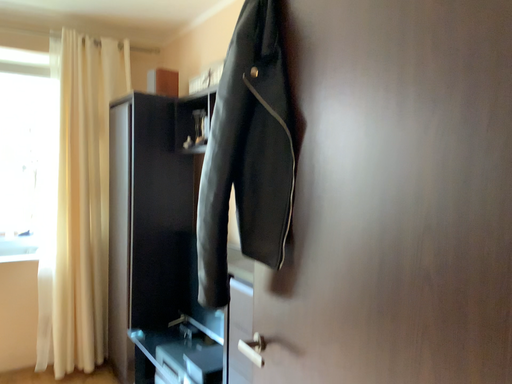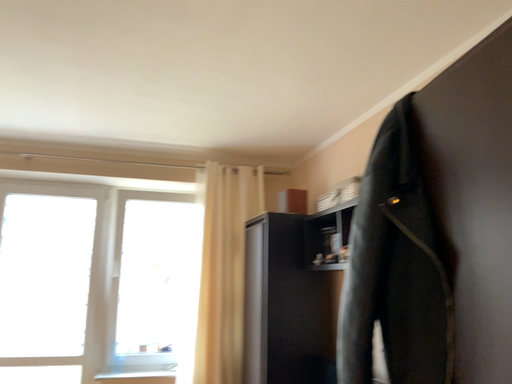
Question: Which way did the camera rotate in the video?

Choices:
 (A) rotated left
 (B) rotated right

Answer: (A)